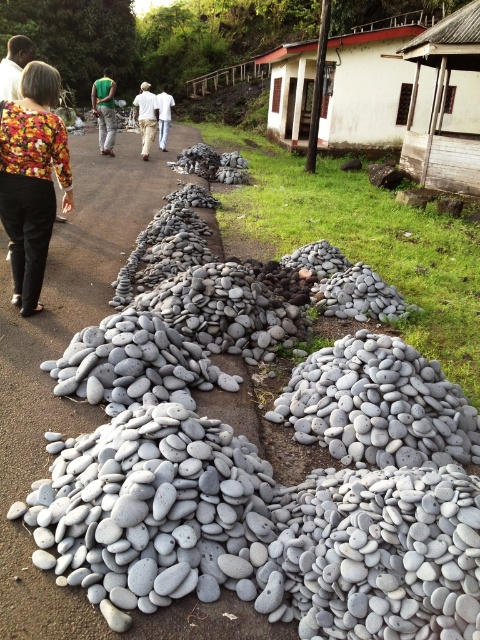
Question: Which point is farther to the camera?

Choices:
 (A) khaki pants at center
 (B) green jersey at center

Answer: (A)

Question: Estimate the real-world distances between objects in this image. Which object is farther from the khaki pants at center?

Choices:
 (A) floral fabric blouse at upper left
 (B) green jersey at center

Answer: (A)

Question: Does green jersey at center have a smaller size compared to khaki pants at center?

Choices:
 (A) no
 (B) yes

Answer: (A)

Question: Can you confirm if floral fabric blouse at upper left is smaller than green jersey at center?

Choices:
 (A) yes
 (B) no

Answer: (A)

Question: Which object appears farthest from the camera in this image?

Choices:
 (A) green jersey at center
 (B) khaki pants at center

Answer: (B)

Question: Can you confirm if floral fabric blouse at upper left is thinner than khaki pants at center?

Choices:
 (A) no
 (B) yes

Answer: (B)